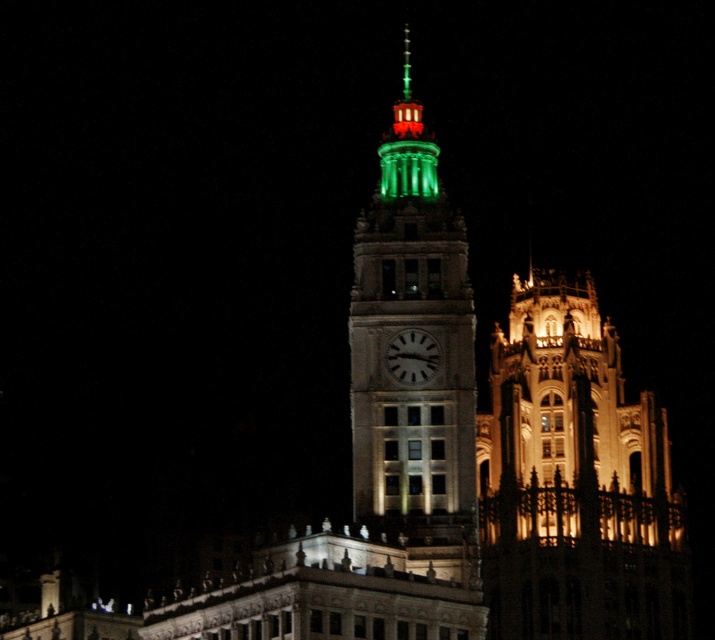
Question: Can you confirm if green illuminated clock tower at center is positioned to the right of white glossy clock at center?

Choices:
 (A) no
 (B) yes

Answer: (A)

Question: Which of these objects is positioned farthest from the green glass spire at upper center?

Choices:
 (A) green illuminated clock tower at center
 (B) illuminated stone tower at right

Answer: (B)

Question: Which object is closer to the camera taking this photo?

Choices:
 (A) green illuminated clock tower at center
 (B) green glass spire at upper center
 (C) white glossy clock at center

Answer: (A)

Question: Which point is farther to the camera?

Choices:
 (A) (527, 490)
 (B) (389, 136)
 (C) (415, 362)
 (D) (453, 556)

Answer: (A)

Question: Does green illuminated clock tower at center lie behind green glass spire at upper center?

Choices:
 (A) yes
 (B) no

Answer: (B)

Question: Does green illuminated clock tower at center have a smaller size compared to white glossy clock at center?

Choices:
 (A) yes
 (B) no

Answer: (B)